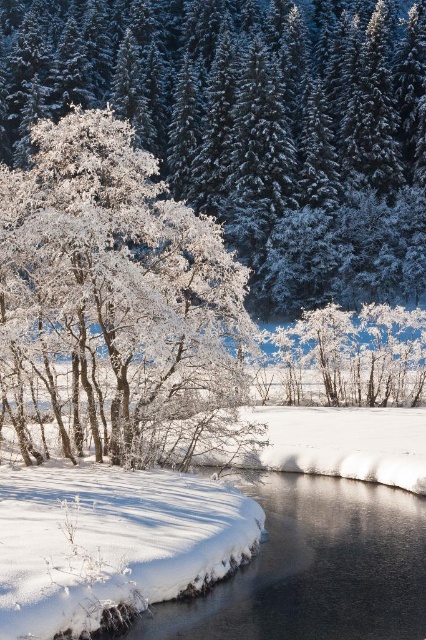
Question: Which object appears farthest from the camera in this image?

Choices:
 (A) white frosty tree at upper left
 (B) frosted white tree at center

Answer: (A)

Question: Considering the relative positions of white frosty tree at upper left and frosted white tree at center in the image provided, where is white frosty tree at upper left located with respect to frosted white tree at center?

Choices:
 (A) below
 (B) above

Answer: (B)

Question: Does white frosty tree at upper left have a smaller size compared to frosted white tree at center?

Choices:
 (A) no
 (B) yes

Answer: (A)

Question: Can you confirm if white frosty tree at upper left is wider than frosted white tree at center?

Choices:
 (A) yes
 (B) no

Answer: (A)

Question: Which of the following is the closest to the observer?

Choices:
 (A) frosted white tree at center
 (B) white frosty tree at upper left

Answer: (A)